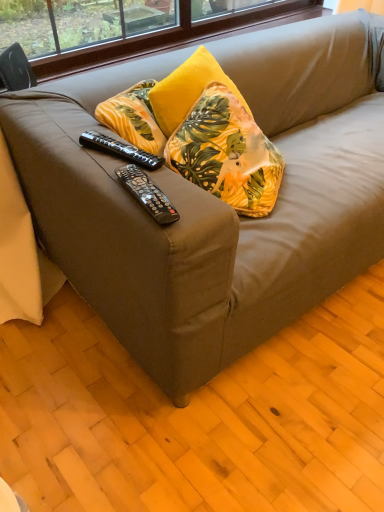
The height and width of the screenshot is (512, 384). I want to click on free space to the left of black plastic remote control at center, the 1th remote control positioned from the back, so click(x=68, y=142).